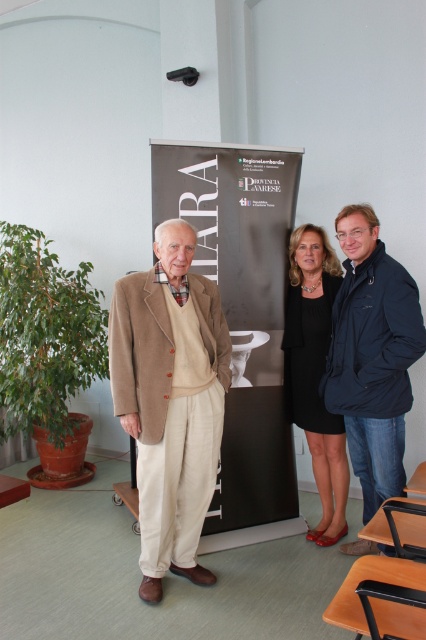
Question: Where is beige woolen coat at center located in relation to dark blue jacket at center in the image?

Choices:
 (A) below
 (B) above

Answer: (A)

Question: Does dark blue jacket at center appear under black satin dress at center?

Choices:
 (A) no
 (B) yes

Answer: (A)

Question: Among these points, which one is farthest from the camera?

Choices:
 (A) (294, 417)
 (B) (255, 342)

Answer: (A)

Question: Which of the following is the closest to the observer?

Choices:
 (A) matte black banner at center
 (B) black satin dress at center
 (C) beige woolen coat at center

Answer: (C)

Question: Is matte black banner at center smaller than beige woolen coat at center?

Choices:
 (A) no
 (B) yes

Answer: (A)

Question: Which of the following is the farthest from the observer?

Choices:
 (A) (365, 388)
 (B) (310, 252)
 (C) (259, 529)
 (D) (152, 465)

Answer: (C)